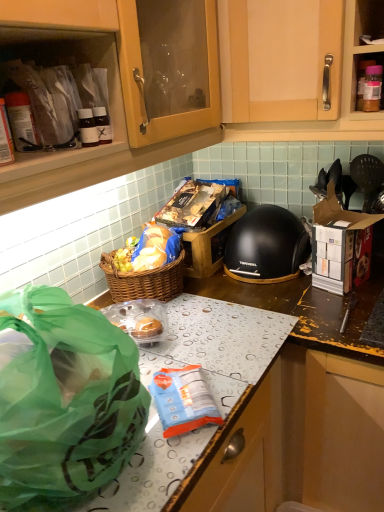
The height and width of the screenshot is (512, 384). Find the location of `matte plastic containers at upper left`. matte plastic containers at upper left is located at coordinates (59, 64).

What do you see at coordinates (65, 398) in the screenshot? I see `green translucent bag at lower left` at bounding box center [65, 398].

What are the coordinates of `black matte helmet at center` in the screenshot? It's located at (266, 246).

Is green translucent bag at lower left directly adjacent to black matte helmet at center?

They are not placed beside each other.

Is green translucent bag at lower left turned away from black matte helmet at center?

No, green translucent bag at lower left is not facing the opposite direction of black matte helmet at center.

Between point (120, 336) and point (293, 217), which one is positioned behind?

Positioned behind is point (293, 217).

Which is more to the right, green translucent bag at lower left or black matte helmet at center?

black matte helmet at center is more to the right.

Is cardboard box at right at the right side of black matte helmet at center?

Yes.

Which is less distant, (x=312, y=275) or (x=233, y=236)?

Clearly, point (x=312, y=275) is closer to the camera than point (x=233, y=236).

Is cardboard box at right not near black matte helmet at center?

Actually, cardboard box at right and black matte helmet at center are a little close together.

From a real-world perspective, who is located lower, cardboard box at right or black matte helmet at center?

black matte helmet at center.

Which is more to the right, cardboard box at right or matte plastic containers at upper left?

cardboard box at right.

From a real-world perspective, which is physically above, cardboard box at right or matte plastic containers at upper left?

matte plastic containers at upper left.

From the image's perspective, who appears lower, cardboard box at right or matte plastic containers at upper left?

cardboard box at right.

Who is shorter, cardboard box at right or matte plastic containers at upper left?

matte plastic containers at upper left.

Does green translucent bag at lower left turn towards matte plastic containers at upper left?

No, green translucent bag at lower left is not aimed at matte plastic containers at upper left.

Considering the positions of objects green translucent bag at lower left and matte plastic containers at upper left in the image provided, who is more to the left, green translucent bag at lower left or matte plastic containers at upper left?

From the viewer's perspective, matte plastic containers at upper left appears more on the left side.

Are green translucent bag at lower left and matte plastic containers at upper left making contact?

No, green translucent bag at lower left is not in contact with matte plastic containers at upper left.

Which object is further away from the camera, green translucent bag at lower left or matte plastic containers at upper left?

matte plastic containers at upper left is further away from the camera.

How distant is matte plastic containers at upper left from blue plastic bag at center?

They are 23.35 inches apart.

From a real-world perspective, which object rests below the other?

From a 3D spatial view, blue plastic bag at center is below.

Could you tell me if matte plastic containers at upper left is facing blue plastic bag at center?

No.

Identify the location of cabinetry behind the blue plastic bag at center. tap(59, 64).

Based on the photo, from the image's perspective, which is above, blue plastic bag at center or green translucent bag at lower left?

green translucent bag at lower left.

Can you confirm if blue plastic bag at center is thinner than green translucent bag at lower left?

Yes, blue plastic bag at center is thinner than green translucent bag at lower left.

Considering the sizes of blue plastic bag at center and green translucent bag at lower left in the image, is blue plastic bag at center taller or shorter than green translucent bag at lower left?

In the image, blue plastic bag at center appears to be shorter than green translucent bag at lower left.

You are a GUI agent. You are given a task and a screenshot of the screen. Output one action in this format:
    pyautogui.click(x=<x>, y=<y>)
    Task: Click on the plastic bag on the left of blue plastic bag at center
    Image resolution: width=384 pixels, height=512 pixels.
    Given the screenshot: What is the action you would take?
    pyautogui.click(x=65, y=398)

Considering their positions, is blue plastic bag at center located in front of or behind black matte helmet at center?

blue plastic bag at center is in front of black matte helmet at center.

From a real-world perspective, is blue plastic bag at center positioned over black matte helmet at center based on gravity?

No, from a real-world perspective, blue plastic bag at center is not above black matte helmet at center.

Is blue plastic bag at center turned away from black matte helmet at center?

No, blue plastic bag at center's orientation is not away from black matte helmet at center.

From the image's perspective, would you say blue plastic bag at center is positioned over black matte helmet at center?

Actually, blue plastic bag at center appears below black matte helmet at center in the image.

This screenshot has height=512, width=384. Find the location of `plastic bag on the left of black matte helmet at center`. plastic bag on the left of black matte helmet at center is located at coordinates 65,398.

At what (x,y) coordinates should I click in order to perform the action: click on cardboard box that is on the right side of black matte helmet at center. Please return your answer as a coordinate pair (x, y). The height and width of the screenshot is (512, 384). Looking at the image, I should click on (335, 242).

Consider the image. Estimate the real-world distances between objects in this image. Which object is closer to cardboard box at right, green translucent bag at lower left or black matte helmet at center?

Based on the image, black matte helmet at center appears to be nearer to cardboard box at right.

Estimate the real-world distances between objects in this image. Which object is further from blue plastic bag at center, black matte helmet at center or cardboard box at right?

cardboard box at right lies further to blue plastic bag at center than the other object.

Based on their spatial positions, is green translucent bag at lower left or cardboard box at right further from black matte helmet at center?

green translucent bag at lower left is further to black matte helmet at center.

Considering their positions, is black matte helmet at center positioned further to matte plastic containers at upper left than cardboard box at right?

cardboard box at right is further to matte plastic containers at upper left.

Estimate the real-world distances between objects in this image. Which object is closer to green translucent bag at lower left, black matte helmet at center or cardboard box at right?

Among the two, black matte helmet at center is located nearer to green translucent bag at lower left.

Considering their positions, is green translucent bag at lower left positioned closer to black matte helmet at center than matte plastic containers at upper left?

matte plastic containers at upper left.

Based on the photo, estimate the real-world distances between objects in this image. Which object is closer to green translucent bag at lower left, cardboard box at right or blue plastic bag at center?

blue plastic bag at center is positioned closer to the anchor green translucent bag at lower left.

Based on their spatial positions, is blue plastic bag at center or black matte helmet at center closer to cardboard box at right?

Based on the image, black matte helmet at center appears to be nearer to cardboard box at right.

I want to click on plastic bag between matte plastic containers at upper left and blue plastic bag at center from top to bottom, so click(65, 398).

Where is `helmet between matte plastic containers at upper left and blue plastic bag at center vertically`? Image resolution: width=384 pixels, height=512 pixels. helmet between matte plastic containers at upper left and blue plastic bag at center vertically is located at coordinates (266, 246).

This screenshot has width=384, height=512. I want to click on helmet between matte plastic containers at upper left and cardboard box at right in the horizontal direction, so click(x=266, y=246).

The height and width of the screenshot is (512, 384). I want to click on plastic bag located between matte plastic containers at upper left and cardboard box at right in the left-right direction, so click(65, 398).